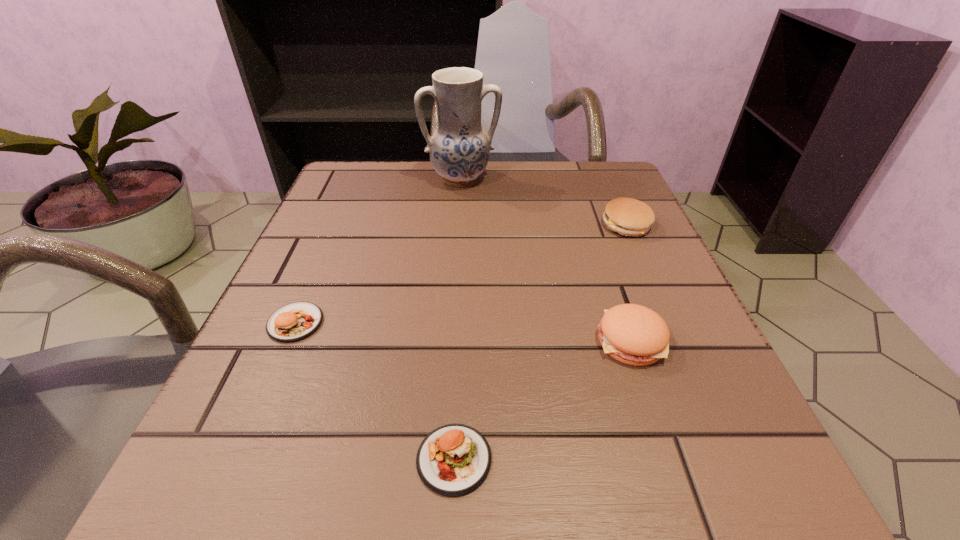
Identify the location of pottery. (459, 149).

Locate an element on the screen. the tallest object is located at coordinates (459, 149).

What are the coordinates of `the fourth nearest object` in the screenshot? It's located at (627, 216).

I want to click on the leftmost patty (food), so point(296,321).

Where is `the shortest patty (food)`? The height and width of the screenshot is (540, 960). the shortest patty (food) is located at coordinates (453, 460).

The width and height of the screenshot is (960, 540). I want to click on the third patty (food) from right to left, so click(x=453, y=460).

Identify the location of vacant space situated on the right of the pottery. The height and width of the screenshot is (540, 960). (621, 179).

Where is `free space located 0.240m on the left of the farthest patty (food)`? free space located 0.240m on the left of the farthest patty (food) is located at coordinates click(x=481, y=225).

You are a GUI agent. You are given a task and a screenshot of the screen. Output one action in this format:
    pyautogui.click(x=<x>, y=<y>)
    Task: Click on the free region located 0.400m on the back of the leftmost object
    
    Given the screenshot: What is the action you would take?
    point(356,181)

I want to click on vacant space located 0.050m on the right of the third patty (food) from right to left, so click(535, 459).